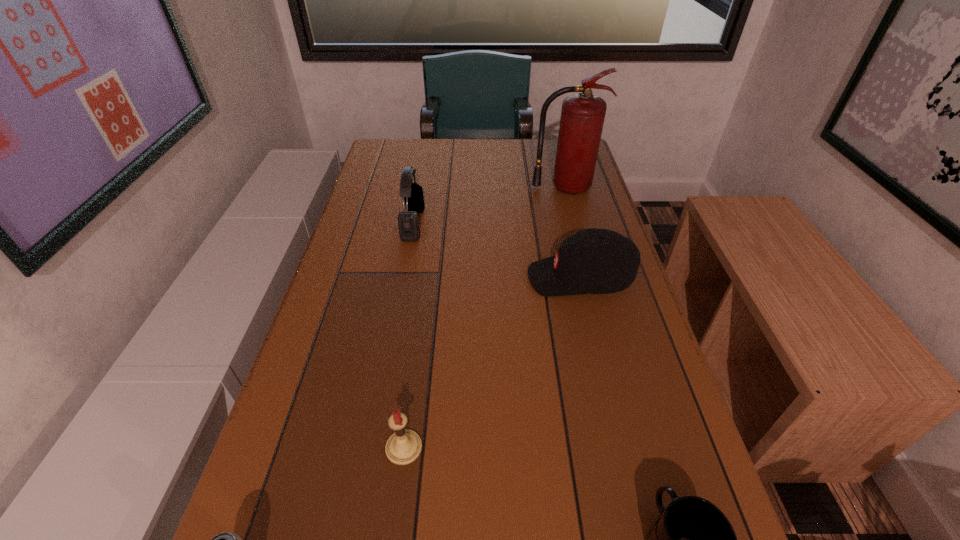
Where is `the farthest object`? The height and width of the screenshot is (540, 960). the farthest object is located at coordinates (582, 118).

Identify the location of fire extinguisher. The width and height of the screenshot is (960, 540). (582, 118).

Locate an element on the screen. This screenshot has width=960, height=540. the second tallest object is located at coordinates (408, 221).

What are the coordinates of `the fifth nearest object` in the screenshot? It's located at (408, 221).

The image size is (960, 540). I want to click on the third farthest object, so pyautogui.click(x=593, y=261).

At what (x,y) coordinates should I click in order to perform the action: click on candle. Please return your answer as a coordinate pair (x, y). The height and width of the screenshot is (540, 960). Looking at the image, I should click on (404, 446).

Find the location of a particular element. This screenshot has width=960, height=540. vacant point located at the front of the fire extinguisher where the nozzle is aimed is located at coordinates (578, 238).

Locate an element on the screen. The height and width of the screenshot is (540, 960). free location located 0.400m on the headband of the second tallest object is located at coordinates (562, 224).

Identify the location of vacant space situated with a logo on the front of the third farthest object. (420, 278).

Locate an element on the screen. vacant space located 0.230m with a logo on the front of the third farthest object is located at coordinates (436, 278).